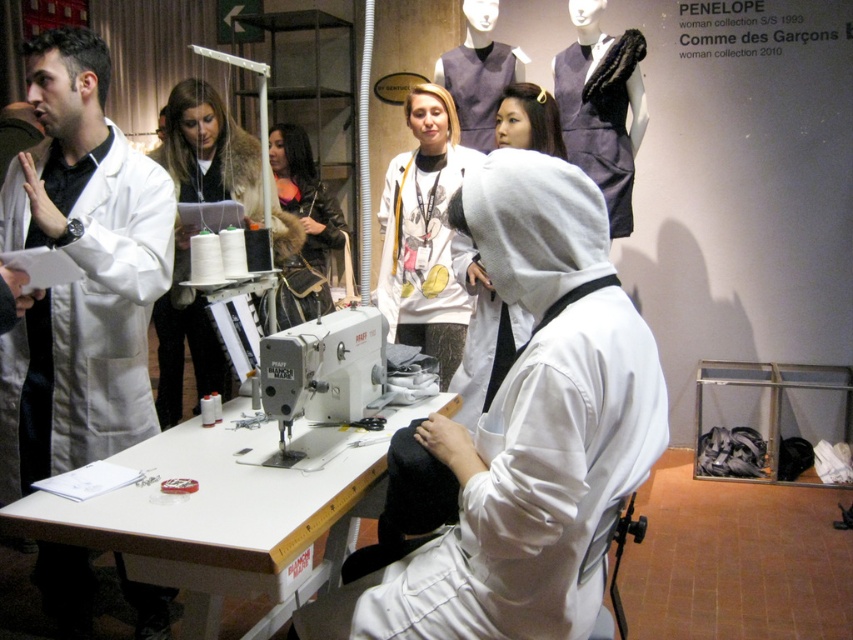
Can you confirm if gray matte hoodie at center is positioned below matte gray dress at upper center?

Yes.

Who is shorter, gray matte hoodie at center or matte gray dress at upper center?

With less height is gray matte hoodie at center.

Which is behind, point (519, 134) or point (489, 145)?

The point (489, 145) is more distant.

Image resolution: width=853 pixels, height=640 pixels. Identify the location of gray matte hoodie at center. (483, 336).

Is matte black spool at center to the right of leather jacket at center from the viewer's perspective?

In fact, matte black spool at center is to the left of leather jacket at center.

Measure the distance between matte black spool at center and camera.

A distance of 9.11 feet exists between matte black spool at center and camera.

Locate an element on the screen. matte black spool at center is located at coordinates (207, 150).

The image size is (853, 640). I want to click on matte black spool at center, so click(207, 150).

Does white cotton robe at center have a greater height compared to matte gray dress at upper center?

Yes.

Who is lower down, white cotton robe at center or matte gray dress at upper center?

white cotton robe at center is lower down.

The image size is (853, 640). What do you see at coordinates (534, 424) in the screenshot?
I see `white cotton robe at center` at bounding box center [534, 424].

The image size is (853, 640). Identify the location of white cotton robe at center. (534, 424).